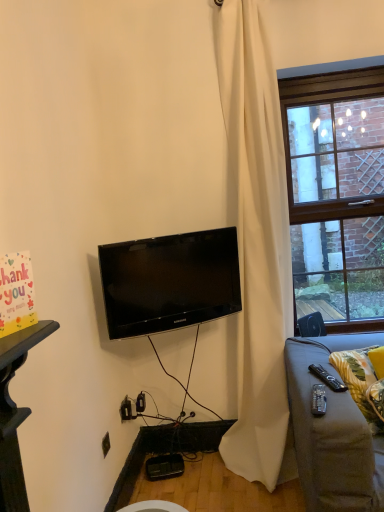
Question: Can we say white matte curtain at center lies outside black plastic remote control at lower right, the 2th remote control from the left?

Choices:
 (A) no
 (B) yes

Answer: (B)

Question: From a real-world perspective, does white matte curtain at center stand above black plastic remote control at lower right, which ranks as the first remote control in back-to-front order?

Choices:
 (A) yes
 (B) no

Answer: (A)

Question: Considering the relative sizes of white matte curtain at center and black plastic remote control at lower right, which appears as the first remote control when viewed from the right, in the image provided, is white matte curtain at center shorter than black plastic remote control at lower right, which appears as the first remote control when viewed from the right,?

Choices:
 (A) no
 (B) yes

Answer: (A)

Question: Is white matte curtain at center closer to the viewer compared to black plastic remote control at lower right, which ranks as the first remote control in back-to-front order?

Choices:
 (A) no
 (B) yes

Answer: (A)

Question: Is the position of white matte curtain at center more distant than that of black plastic remote control at lower right, which appears as the first remote control when viewed from the right?

Choices:
 (A) yes
 (B) no

Answer: (A)

Question: Does white matte curtain at center have a larger size compared to black plastic remote control at lower right, which appears as the first remote control when viewed from the right?

Choices:
 (A) yes
 (B) no

Answer: (A)

Question: From a real-world perspective, is yellow fabric pillow at lower right below white matte curtain at center?

Choices:
 (A) no
 (B) yes

Answer: (B)

Question: From a real-world perspective, is yellow fabric pillow at lower right positioned over white matte curtain at center based on gravity?

Choices:
 (A) yes
 (B) no

Answer: (B)

Question: Can white matte curtain at center be found inside yellow fabric pillow at lower right?

Choices:
 (A) no
 (B) yes

Answer: (A)

Question: Is yellow fabric pillow at lower right touching white matte curtain at center?

Choices:
 (A) yes
 (B) no

Answer: (B)

Question: Can you confirm if yellow fabric pillow at lower right is positioned to the right of white matte curtain at center?

Choices:
 (A) no
 (B) yes

Answer: (B)

Question: Does yellow fabric pillow at lower right turn towards white matte curtain at center?

Choices:
 (A) no
 (B) yes

Answer: (A)

Question: Is white matte curtain at center shorter than black plastic remote control at lower right, the first remote control in the front-to-back sequence?

Choices:
 (A) no
 (B) yes

Answer: (A)